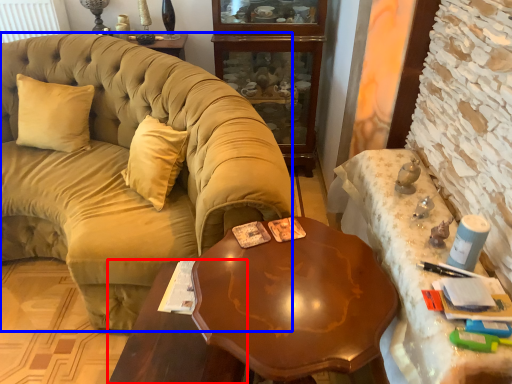
Question: Which object appears farthest to the camera in this image, table (highlighted by a red box) or studio couch (highlighted by a blue box)?

Choices:
 (A) table
 (B) studio couch

Answer: (B)